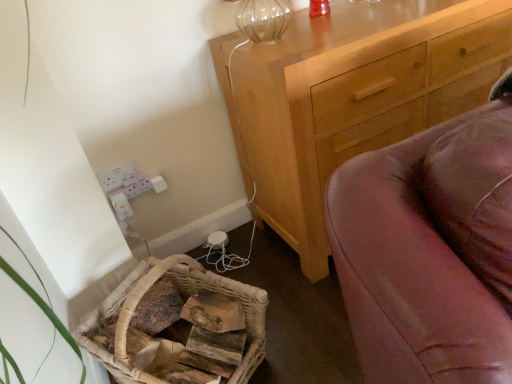
Question: Is light brown wooden chest of drawers at upper right to the left of woven wood basket at lower left from the viewer's perspective?

Choices:
 (A) no
 (B) yes

Answer: (A)

Question: Is woven wood basket at lower left located within light brown wooden chest of drawers at upper right?

Choices:
 (A) no
 (B) yes

Answer: (A)

Question: From a real-world perspective, is light brown wooden chest of drawers at upper right under woven wood basket at lower left?

Choices:
 (A) yes
 (B) no

Answer: (B)

Question: Is light brown wooden chest of drawers at upper right placed right next to woven wood basket at lower left?

Choices:
 (A) yes
 (B) no

Answer: (B)

Question: Does light brown wooden chest of drawers at upper right have a larger size compared to woven wood basket at lower left?

Choices:
 (A) no
 (B) yes

Answer: (B)

Question: From the image's perspective, is light brown wooden chest of drawers at upper right on top of woven wood basket at lower left?

Choices:
 (A) no
 (B) yes

Answer: (B)

Question: Is woven wood basket at lower left oriented towards light brown wooden chest of drawers at upper right?

Choices:
 (A) yes
 (B) no

Answer: (B)

Question: Is woven wood basket at lower left shorter than light brown wooden chest of drawers at upper right?

Choices:
 (A) no
 (B) yes

Answer: (B)

Question: Is light brown wooden chest of drawers at upper right surrounded by woven wood basket at lower left?

Choices:
 (A) no
 (B) yes

Answer: (A)

Question: From the image's perspective, is woven wood basket at lower left under light brown wooden chest of drawers at upper right?

Choices:
 (A) no
 (B) yes

Answer: (B)

Question: Are woven wood basket at lower left and light brown wooden chest of drawers at upper right making contact?

Choices:
 (A) yes
 (B) no

Answer: (B)

Question: Is woven wood basket at lower left outside of light brown wooden chest of drawers at upper right?

Choices:
 (A) yes
 (B) no

Answer: (A)

Question: From a real-world perspective, is woven wood basket at lower left positioned above or below light brown wooden chest of drawers at upper right?

Choices:
 (A) above
 (B) below

Answer: (B)